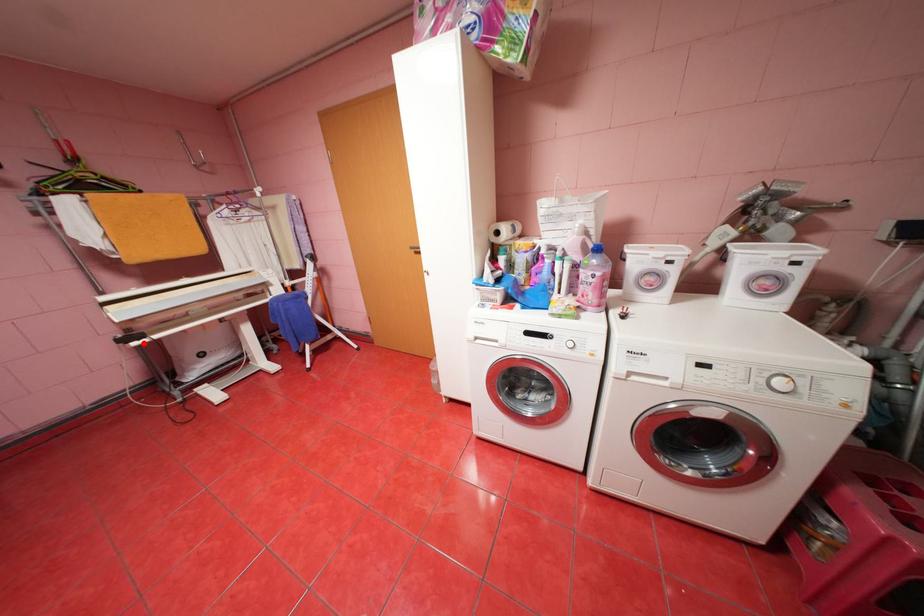
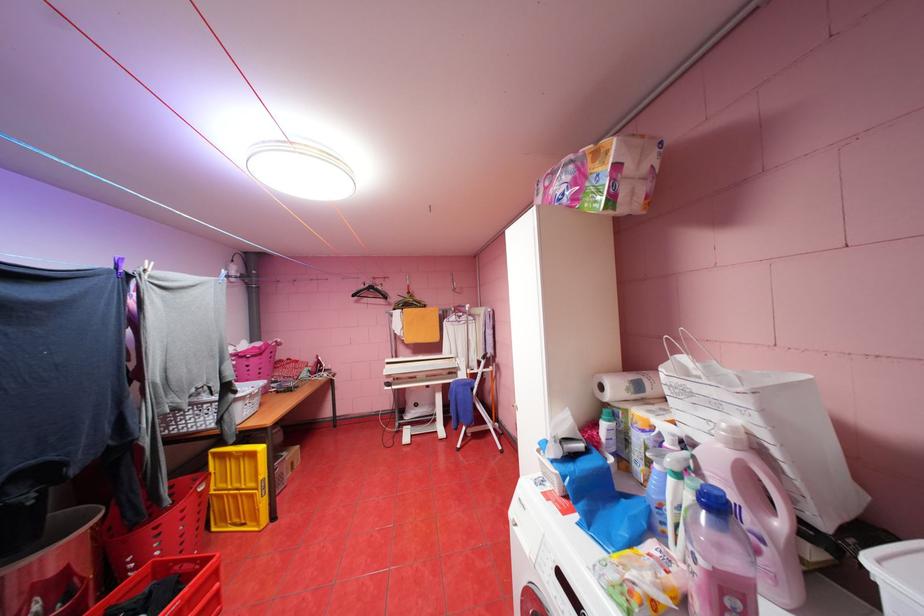
Question: I am providing you with two images of the same scene from different viewpoints. A red point is shown in image1. For the corresponding object point in image2, is it positioned nearer or farther from the camera?

Choices:
 (A) Nearer
 (B) Farther

Answer: (B)